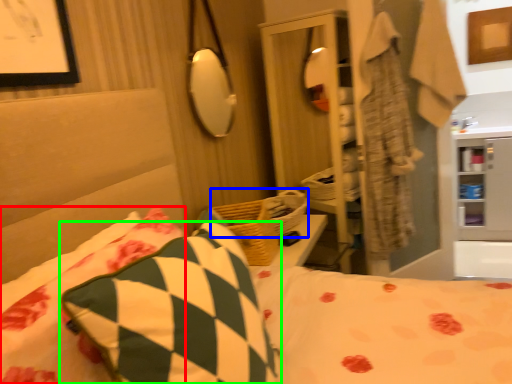
Question: Which is farther away from pillow (highlighted by a red box)? basket (highlighted by a blue box) or pillow (highlighted by a green box)?

Choices:
 (A) basket
 (B) pillow

Answer: (A)